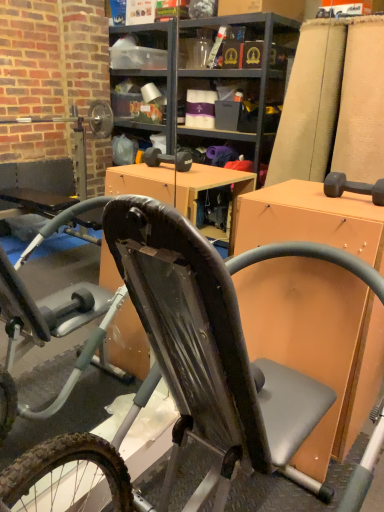
You are a GUI agent. You are given a task and a screenshot of the screen. Output one action in this format:
    pyautogui.click(x=<x>, y=<y>)
    Task: Click on the free space above orange matte desk at center (from a real-world perspective)
    
    Given the screenshot: What is the action you would take?
    point(327,200)